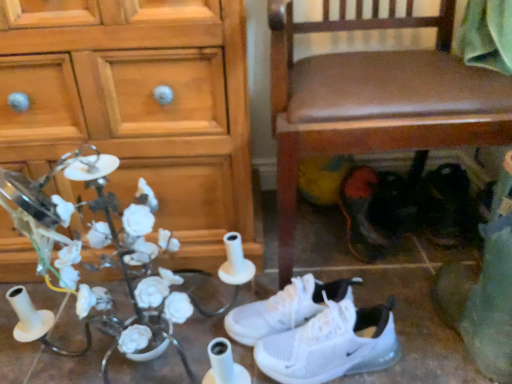
Question: Is white ceramic flowers at left bigger or smaller than wooden cabinet at left?

Choices:
 (A) small
 (B) big

Answer: (A)

Question: From a real-world perspective, is white ceramic flowers at left physically located above or below wooden cabinet at left?

Choices:
 (A) above
 (B) below

Answer: (B)

Question: Which is nearer to the black leather shoes at lower right, placed as the first footwear when sorted from right to left?

Choices:
 (A) wooden cabinet at left
 (B) white mesh sneakers at lower center, which is the third footwear in right-to-left order
 (C) dark red leather shoes at lower right, the 3th footwear in the left-to-right sequence
 (D) white mesh sneakers at center, which is the 4th footwear in right-to-left order
 (E) brown leather chair at lower right

Answer: (C)

Question: Considering the real-world distances, which object is closest to the dark red leather shoes at lower right, the 3th footwear in the left-to-right sequence?

Choices:
 (A) white mesh sneakers at lower center, the second footwear viewed from the left
 (B) black leather shoes at lower right, which is the fourth footwear in left-to-right order
 (C) white ceramic flowers at left
 (D) brown leather chair at lower right
 (E) wooden cabinet at left

Answer: (B)